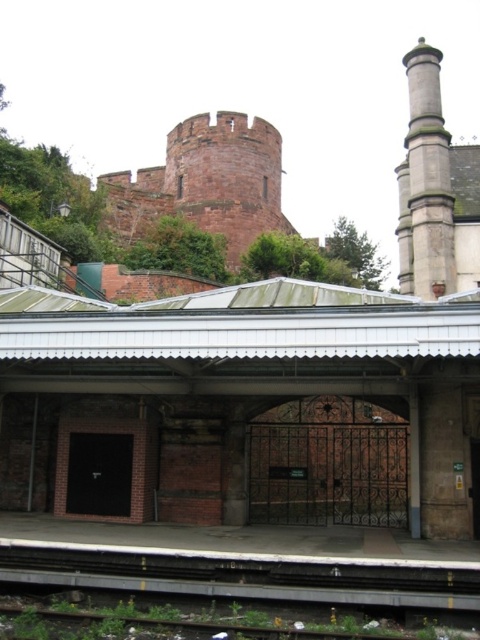
Question: Does smooth concrete train track at bottom appear on the right side of reddish-brown stone tower at upper center?

Choices:
 (A) yes
 (B) no

Answer: (A)

Question: Is smooth concrete train track at bottom behind reddish-brown stone tower at upper center?

Choices:
 (A) no
 (B) yes

Answer: (A)

Question: Which point is farther from the camera taking this photo?

Choices:
 (A) (235, 188)
 (B) (224, 582)

Answer: (A)

Question: Does smooth concrete train track at bottom appear on the right side of reddish-brown stone tower at upper center?

Choices:
 (A) no
 (B) yes

Answer: (B)